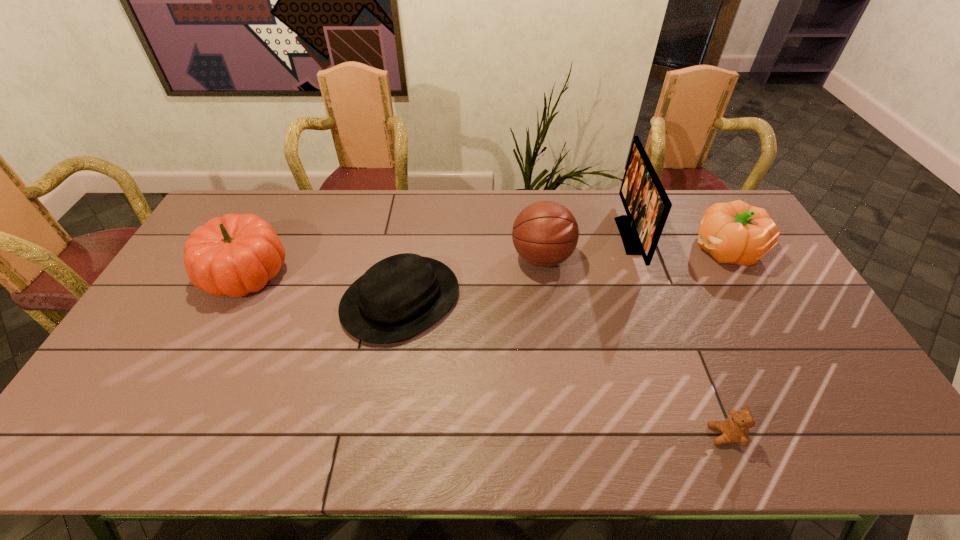
Find the location of a particular element. This screenshot has width=960, height=540. object that is at the near edge is located at coordinates (735, 429).

Locate an element on the screen. object located in the left edge section of the desktop is located at coordinates (237, 254).

At what (x,y) coordinates should I click in order to perform the action: click on object that is at the right edge. Please return your answer as a coordinate pair (x, y). Looking at the image, I should click on (735, 232).

Where is `object positioned at the far right corner`? object positioned at the far right corner is located at coordinates click(x=735, y=232).

Identify the location of free space at the far edge of the desktop. (271, 212).

Find the location of a particular element. vacant space at the near edge of the desktop is located at coordinates (423, 424).

In the image, there is a desktop. Where is `vacant space at the right edge`? Image resolution: width=960 pixels, height=540 pixels. vacant space at the right edge is located at coordinates (811, 339).

The width and height of the screenshot is (960, 540). Identify the location of free region at the far left corner. (250, 199).

Locate an element on the screen. The image size is (960, 540). free space between the fifth object from right to left and the rightmost object is located at coordinates (564, 274).

Locate an element on the screen. vacant space that's between the fedora and the right pumpkin is located at coordinates (564, 274).